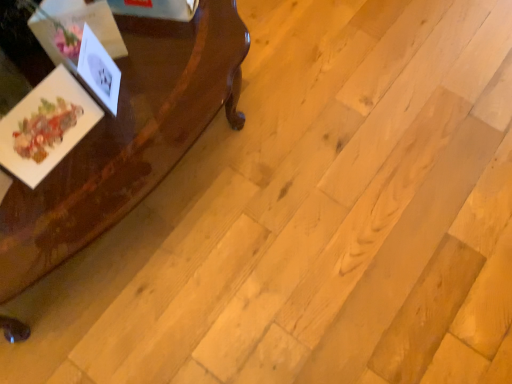
Question: Can you confirm if matte paper postcard at left, the 2th postcard in the right-to-left sequence, is positioned to the right of glossy wood table at left?

Choices:
 (A) no
 (B) yes

Answer: (B)

Question: Are matte paper postcard at left, the 2th postcard in the right-to-left sequence, and glossy wood table at left far apart?

Choices:
 (A) yes
 (B) no

Answer: (B)

Question: Does matte paper postcard at left, the 2th postcard in the right-to-left sequence, have a greater width compared to glossy wood table at left?

Choices:
 (A) yes
 (B) no

Answer: (B)

Question: Can you confirm if matte paper postcard at left, the 1th postcard in the left-to-right sequence, is bigger than glossy wood table at left?

Choices:
 (A) yes
 (B) no

Answer: (B)

Question: Is glossy wood table at left inside matte paper postcard at left, the 2th postcard in the right-to-left sequence?

Choices:
 (A) no
 (B) yes

Answer: (A)

Question: From the image's perspective, would you say matte paper postcard at left, the 1th postcard in the left-to-right sequence, is positioned over glossy wood table at left?

Choices:
 (A) yes
 (B) no

Answer: (A)

Question: Is matte paper postcard at left, the 1th postcard in the left-to-right sequence, to the left of white paper at left, which appears as the 2th postcard when viewed from the left, from the viewer's perspective?

Choices:
 (A) no
 (B) yes

Answer: (B)

Question: Can you confirm if matte paper postcard at left, the 1th postcard in the left-to-right sequence, is positioned to the right of white paper at left, which appears as the 2th postcard when viewed from the left?

Choices:
 (A) yes
 (B) no

Answer: (B)

Question: Is matte paper postcard at left, the 2th postcard in the right-to-left sequence, not near white paper at left, which appears as the 1th postcard when viewed from the right?

Choices:
 (A) no
 (B) yes

Answer: (A)

Question: Is matte paper postcard at left, the 2th postcard in the right-to-left sequence, aimed at white paper at left, which appears as the 1th postcard when viewed from the right?

Choices:
 (A) no
 (B) yes

Answer: (A)

Question: Does matte paper postcard at left, the 1th postcard in the left-to-right sequence, have a smaller size compared to white paper at left, which appears as the 1th postcard when viewed from the right?

Choices:
 (A) no
 (B) yes

Answer: (A)

Question: From a real-world perspective, is matte paper postcard at left, the 1th postcard in the left-to-right sequence, positioned under white paper at left, which appears as the 2th postcard when viewed from the left, based on gravity?

Choices:
 (A) yes
 (B) no

Answer: (A)

Question: Is glossy wood table at left to the right of matte paper postcard at left, the 1th postcard in the left-to-right sequence, from the viewer's perspective?

Choices:
 (A) yes
 (B) no

Answer: (B)